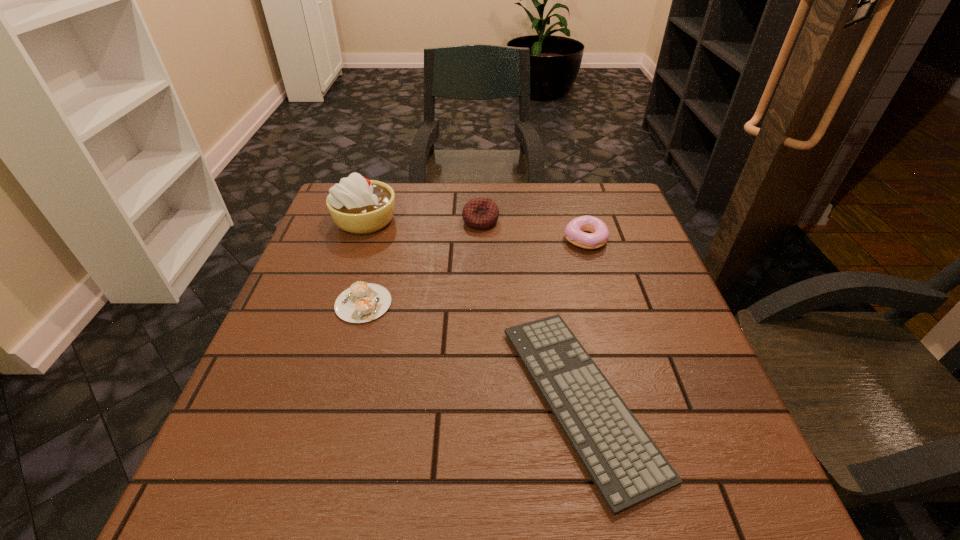
This screenshot has width=960, height=540. Find the location of `the tallest object`. the tallest object is located at coordinates (357, 205).

I want to click on the second tallest object, so click(480, 213).

Find the location of `doughnut`. doughnut is located at coordinates (575, 230).

Locate an element on the screen. The image size is (960, 540). cappuccino is located at coordinates (363, 302).

Find the location of `the shortest object`. the shortest object is located at coordinates (626, 466).

At what (x,y) coordinates should I click in order to perform the action: click on free space located 0.110m on the right of the whipped cream. Please return your answer as a coordinate pair (x, y). This screenshot has width=960, height=540. Looking at the image, I should click on click(438, 220).

At what (x,y) coordinates should I click in order to perform the action: click on vacant area situated 0.300m on the left of the beanbag. Please return your answer as a coordinate pair (x, y). Looking at the image, I should click on (351, 221).

Where is `free space located on the front of the doughnut`? free space located on the front of the doughnut is located at coordinates (600, 289).

This screenshot has height=540, width=960. I want to click on vacant space located on the front of the cappuccino, so click(321, 461).

Locate an element on the screen. vacant space located 0.130m on the back of the computer keyboard is located at coordinates (557, 276).